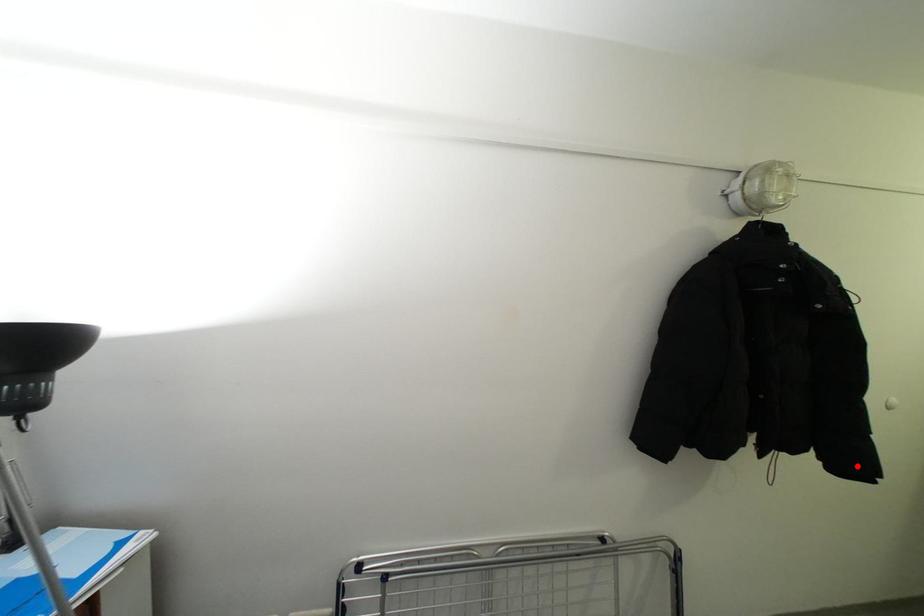
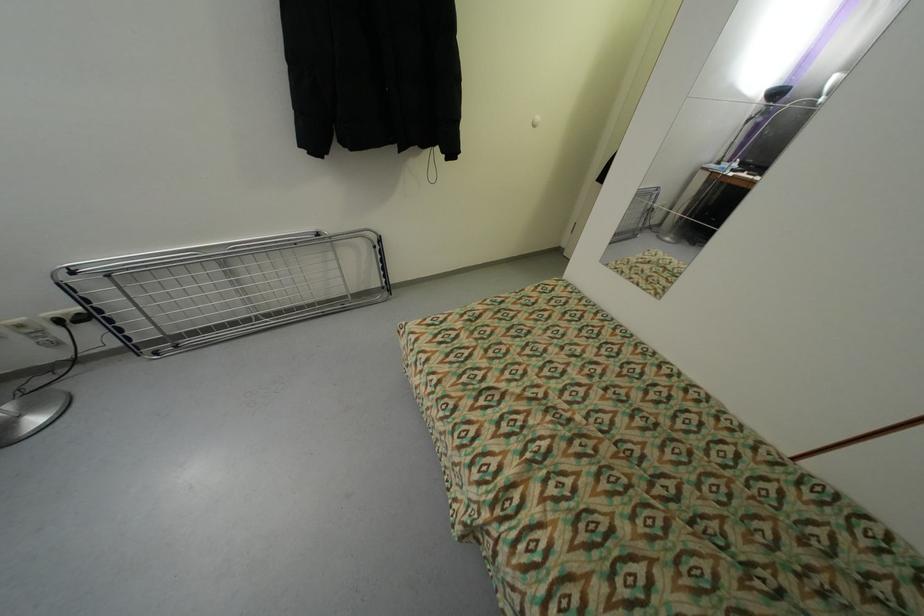
Locate, in the second image, the point that corresponds to the highlighted location in the first image.

(457, 152)